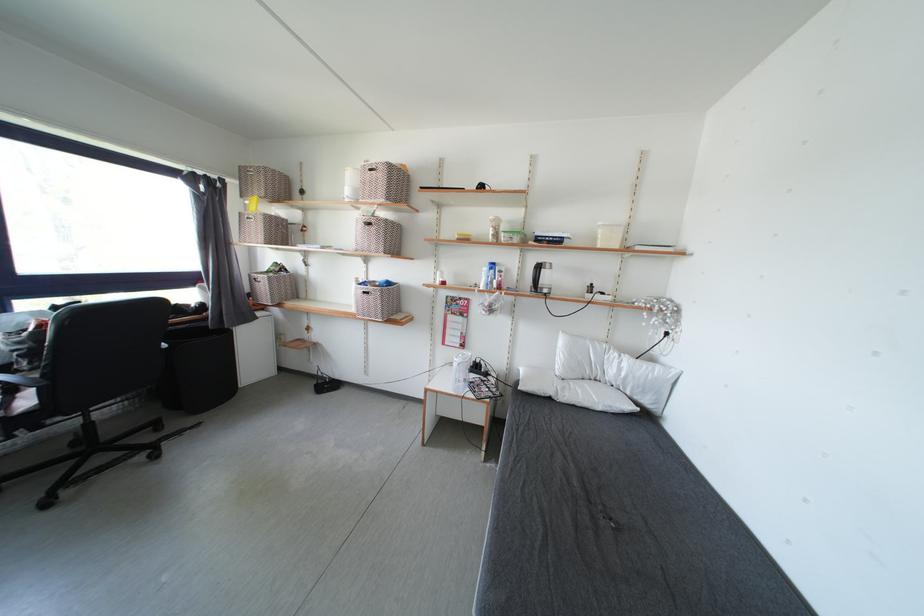
Locate an element on the screen. white spray bottle is located at coordinates point(459,371).